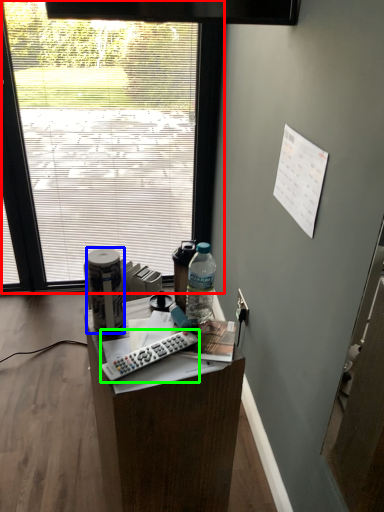
Question: Which object is the closest to the window (highlighted by a red box)? Choose among these: bottle (highlighted by a blue box) or remote control (highlighted by a green box).

Choices:
 (A) bottle
 (B) remote control

Answer: (A)